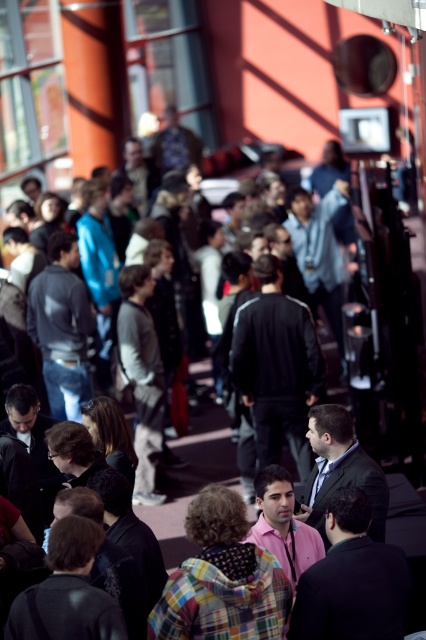
Can you confirm if black matte jacket at center is positioned above dark gray suit at center?

Yes, black matte jacket at center is above dark gray suit at center.

Who is more distant from viewer, (305, 448) or (336, 484)?

The point (305, 448) is more distant.

Between point (270, 394) and point (376, 483), which one is positioned in front?

Positioned in front is point (376, 483).

Identify the location of black matte jacket at center. (276, 365).

Is black matte jacket at center further to camera compared to denim jacket at center?

No.

Between black matte jacket at center and denim jacket at center, which one appears on the left side from the viewer's perspective?

denim jacket at center is more to the left.

Between point (294, 388) and point (60, 241), which one is positioned in front?

Point (294, 388)

This screenshot has height=640, width=426. I want to click on black matte jacket at center, so click(x=276, y=365).

Is denim jacket at center to the left of dark gray suit at center from the viewer's perspective?

Yes, denim jacket at center is to the left of dark gray suit at center.

How distant is denim jacket at center from dark gray suit at center?

denim jacket at center and dark gray suit at center are 15.29 feet apart from each other.

Who is more forward, (40, 289) or (325, 461)?

Point (325, 461)

Identify the location of denim jacket at center. (62, 326).